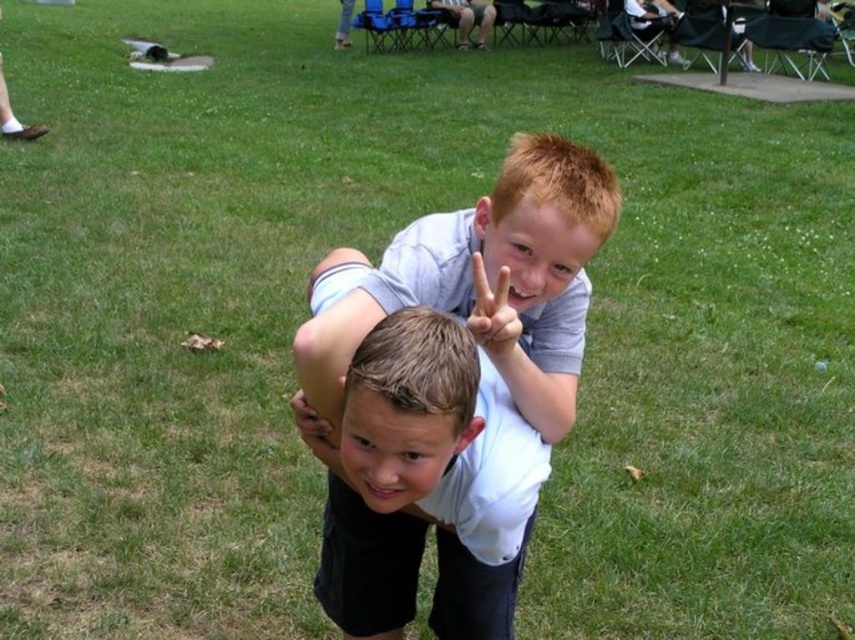
Question: Does light brown hair at center appear under smooth brown hand at center?

Choices:
 (A) yes
 (B) no

Answer: (B)

Question: Which object is the farthest from the smooth brown hand at center?

Choices:
 (A) light brown hair at center
 (B) matte skin hand at upper center
 (C) blonde hair at center
 (D) white matte shirt at center

Answer: (C)

Question: Is blonde hair at center behind smooth brown hand at center?

Choices:
 (A) yes
 (B) no

Answer: (B)

Question: Which point is closer to the camera taking this photo?

Choices:
 (A) (557, 141)
 (B) (322, 458)
 (C) (398, 374)
 (D) (482, 346)

Answer: (C)

Question: Does blonde hair at center come behind smooth brown hand at center?

Choices:
 (A) no
 (B) yes

Answer: (A)

Question: Among these objects, which one is farthest from the camera?

Choices:
 (A) white matte shirt at center
 (B) smooth brown hand at center
 (C) light brown hair at center
 (D) matte skin hand at upper center

Answer: (B)